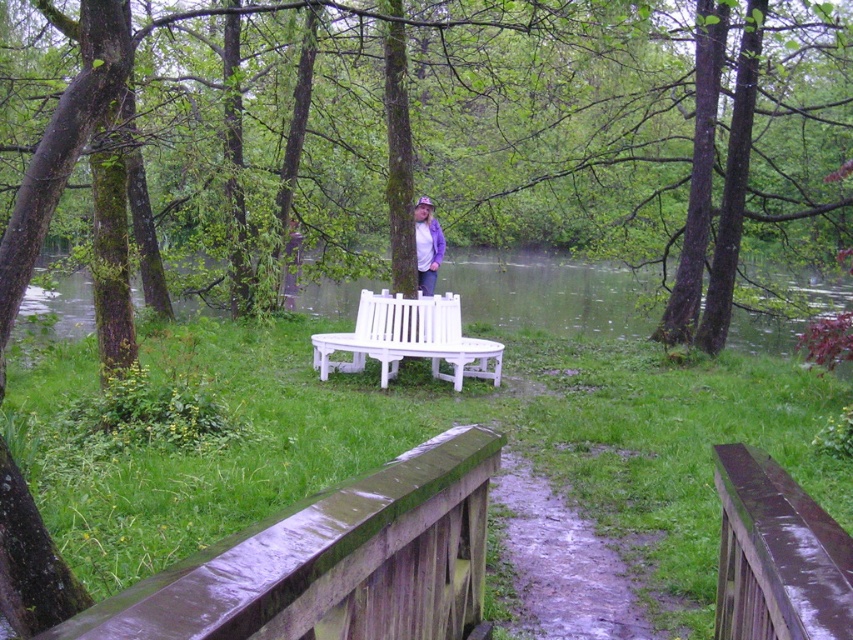
You are planning to place a small potted plant between the wooden rail at lower left and the white smooth bench at center. Based on their sizes, which object should the plant be closer to?

The wooden rail at lower left has a smaller size compared to the white smooth bench at center, so the plant should be placed closer to the wooden rail at lower left to maintain balance between the two objects.

You are a photographer setting up equipment on the wooden rail at lower left. You have a purple fabric jacket at center that you need to place on the rail. Will the jacket fit entirely on the rail without overlapping the edges?

The wooden rail at lower left has a larger width than the purple fabric jacket at center, so the jacket will fit entirely on the rail without overlapping the edges.